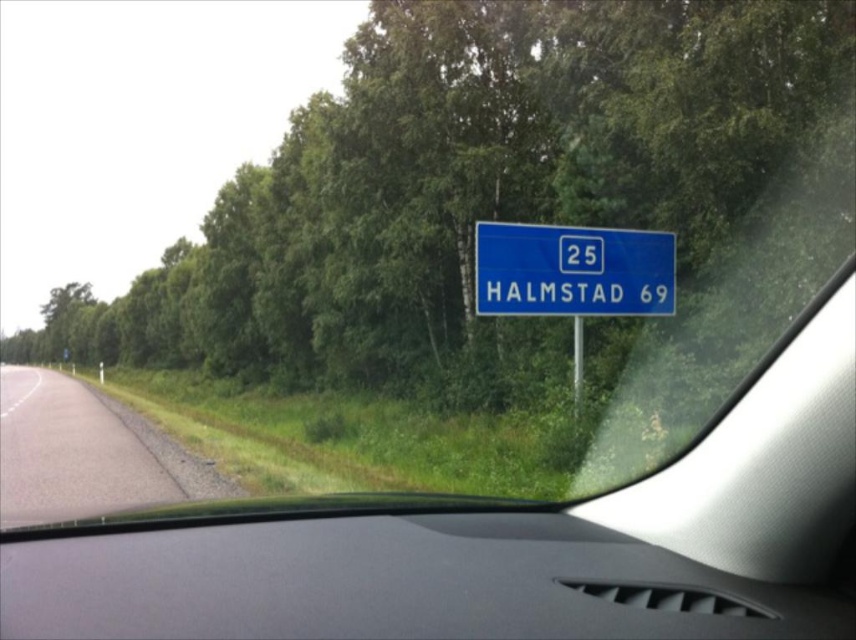
You are sitting in the driver seat of the vehicle and want to check two points on the windshield. The first point is at coordinates point (x=119, y=545) and the second point is at point (x=544, y=234). Which point is closer to your eyes?

Point (x=119, y=545) is closer to the viewer than point (x=544, y=234).

Looking at this image, you are driving a car and need to know if the gray asphalt road at lower left is wider than the blue plastic sign at center. Can you confirm this based on the scene?

The gray asphalt road at lower left is wider than the blue plastic sign at center because its width surpasses the sign.